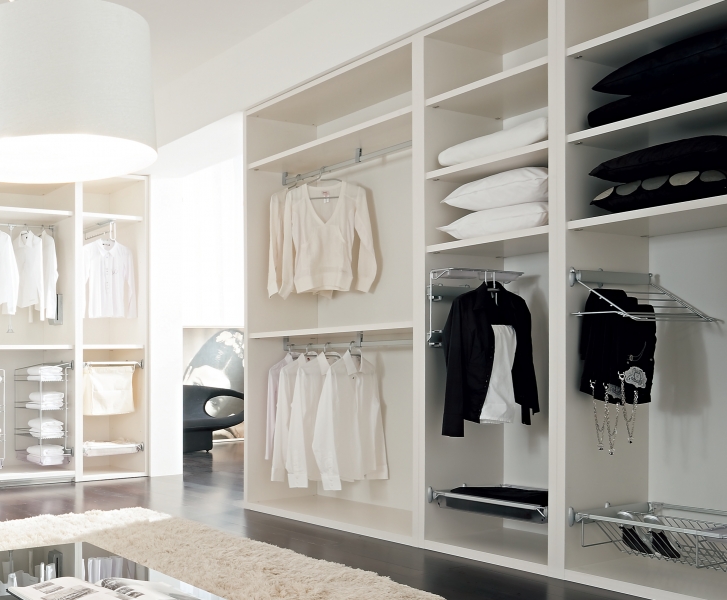
At what (x,y) coordinates should I click in order to perform the action: click on area rug. Please return your answer as a coordinate pair (x, y). Looking at the image, I should click on (249, 560).